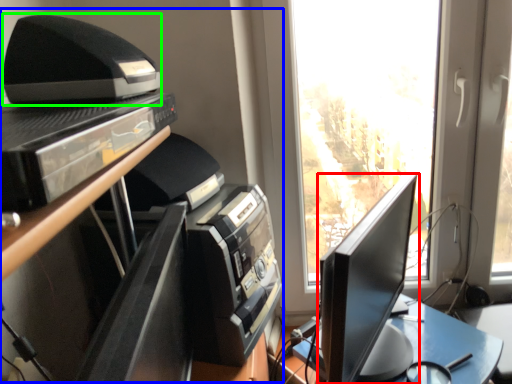
Question: Based on their relative distances, which object is farther from computer monitor (highlighted by a red box)? Choose from entertainment center (highlighted by a blue box) and printer (highlighted by a green box).

Choices:
 (A) entertainment center
 (B) printer

Answer: (B)